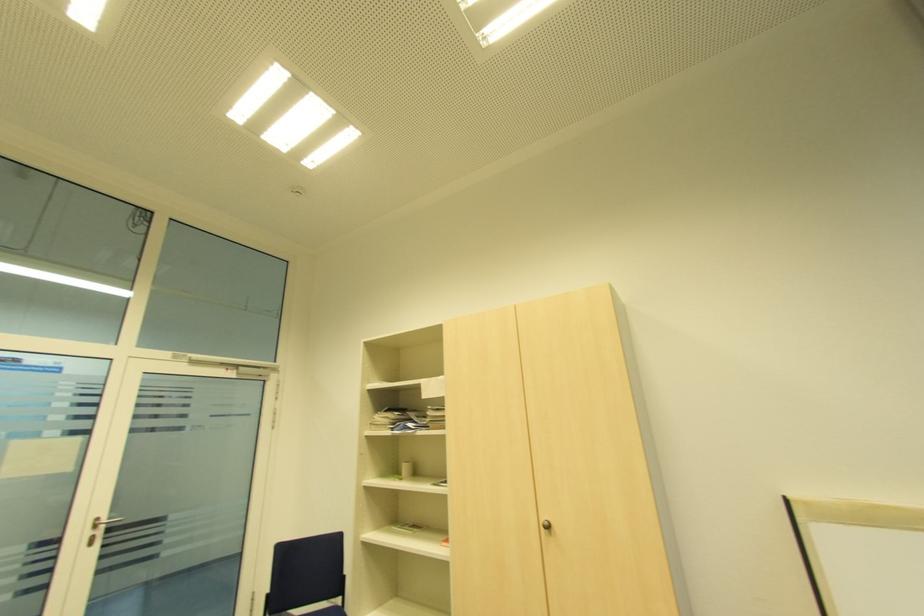
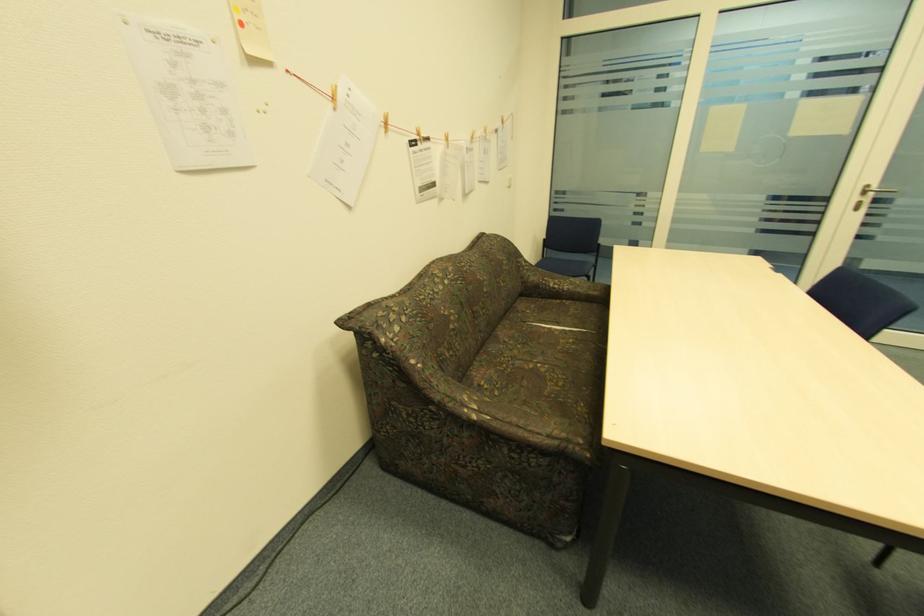
The point at (90,533) is marked in the first image. Where is the corresponding point in the second image?

(859, 199)